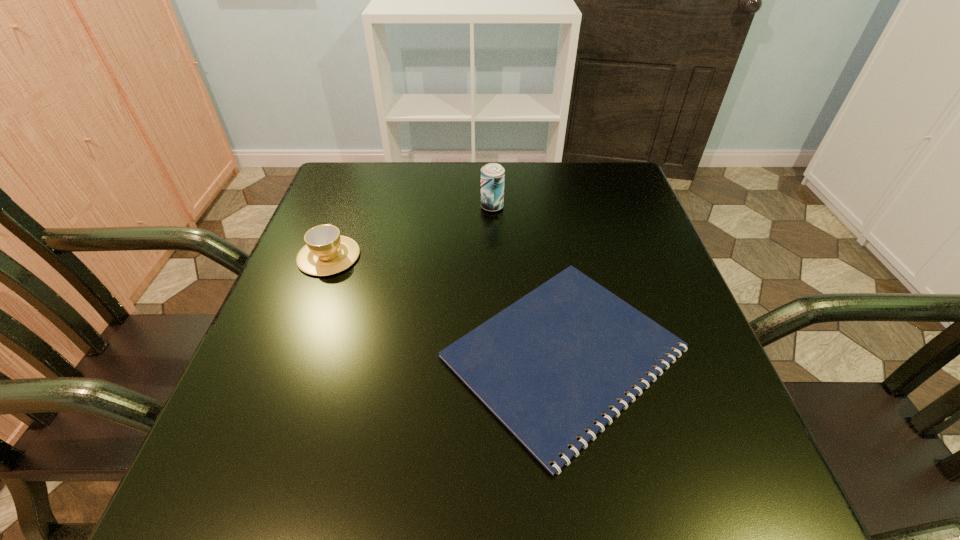
Locate an element on the screen. Image resolution: width=960 pixels, height=540 pixels. object present at the far edge is located at coordinates (492, 175).

Where is `object located in the near edge section of the desktop`? object located in the near edge section of the desktop is located at coordinates (548, 366).

You are a GUI agent. You are given a task and a screenshot of the screen. Output one action in this format:
    pyautogui.click(x=<x>, y=<y>)
    Task: Click on the object located at the left edge
    
    Given the screenshot: What is the action you would take?
    pyautogui.click(x=326, y=252)

Image resolution: width=960 pixels, height=540 pixels. Find the location of `object positioned at the right edge`. object positioned at the right edge is located at coordinates (548, 366).

Locate an element on the screen. The height and width of the screenshot is (540, 960). object that is at the near right corner is located at coordinates (548, 366).

At what (x,y) coordinates should I click in order to perform the action: click on free location at the far edge of the desktop. Please return your answer as a coordinate pair (x, y). Looking at the image, I should click on (480, 199).

In the image, there is a desktop. At what (x,y) coordinates should I click in order to perform the action: click on blank space at the near edge. Please return your answer as a coordinate pair (x, y). This screenshot has width=960, height=540. Looking at the image, I should click on (513, 470).

At what (x,y) coordinates should I click in order to perform the action: click on blank area at the left edge. Please return your answer as a coordinate pair (x, y). Looking at the image, I should click on (324, 286).

Find the location of a particular element. blank space at the right edge is located at coordinates (724, 436).

Locate an element on the screen. The image size is (960, 540). free space at the far right corner of the desktop is located at coordinates (609, 176).